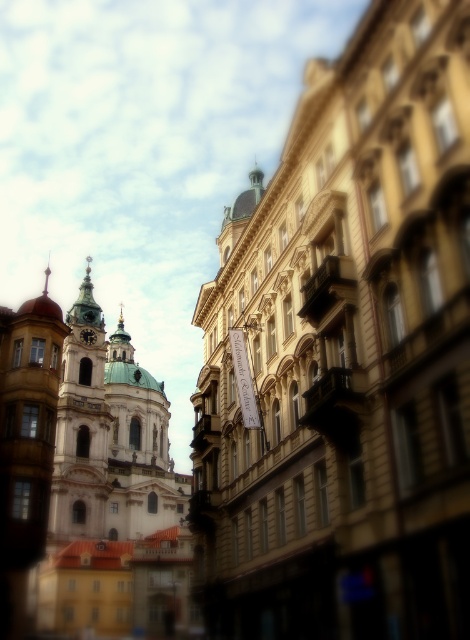
Can you confirm if golden stone tower at left is wider than gold metallic clock at center-left?

Yes.

You are a GUI agent. You are given a task and a screenshot of the screen. Output one action in this format:
    pyautogui.click(x=<x>, y=<y>)
    Task: Click on the golden stone tower at left
    This screenshot has height=640, width=470.
    Given the screenshot: What is the action you would take?
    pyautogui.click(x=80, y=428)